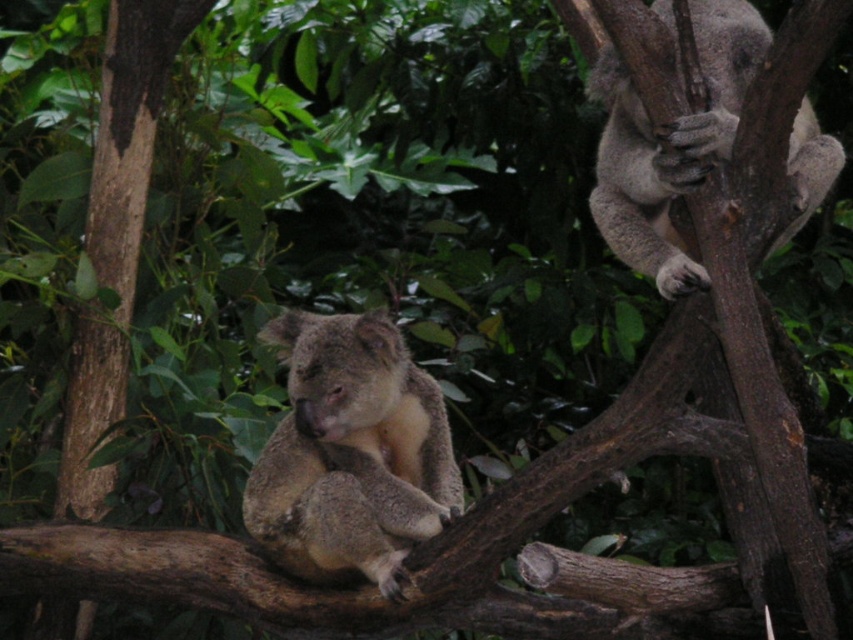
Consider the image. You are an animal researcher observing the image. The camera is positioned at the origin point. Can you determine the direction of the fuzzy brown koala at center relative to the camera based on its coordinates?

The fuzzy brown koala at center is located at coordinates point [351,452]. Since the x coordinate is 0.708, which is greater than 0.5, it is to the right of the center. The y coordinate is 0.413, which is below the center point of 0.5, so it is slightly below the center horizontally and slightly below vertically. Therefore, the fuzzy brown koala at center is positioned to the right and slightly below the camera.

You are a wildlife photographer aiming to capture a clear photo of the fuzzy brown koala at center. You notice that the camera focus point is currently set at point (351, 452). Is this the correct point to focus on to get a sharp image of the fuzzy brown koala at center?

Yes, the camera focus point at (351, 452) is correct because the fuzzy brown koala at center is located exactly at that coordinate.

You are a wildlife photographer aiming to capture both koalas in a single frame. Given that your camera has a 50mm lens, which has a field of view that can capture objects up to 10 feet apart, can you include both the fuzzy brown koala at center and the other koala in the background in your shot?

The two koalas are 9.72 feet apart, which is within the 10 feet field of view of the 50mm lens. Therefore, you can include both the fuzzy brown koala at center and the other koala in the background in your shot.